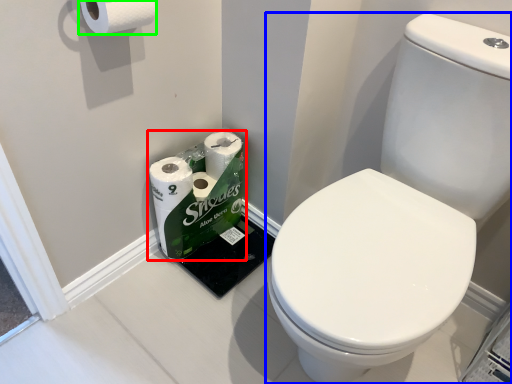
Question: Which object is the farthest from toilet paper (highlighted by a red box)? Choose among these: toilet (highlighted by a blue box) or toilet paper (highlighted by a green box).

Choices:
 (A) toilet
 (B) toilet paper

Answer: (B)